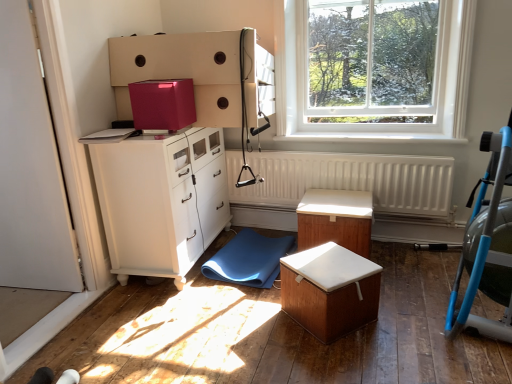
You are a GUI agent. You are given a task and a screenshot of the screen. Output one action in this format:
    pyautogui.click(x=<x>, y=<y>)
    Task: Click on the vacant space situated on the left part of blue plastic baby carriage at right
    
    Given the screenshot: What is the action you would take?
    pyautogui.click(x=380, y=339)